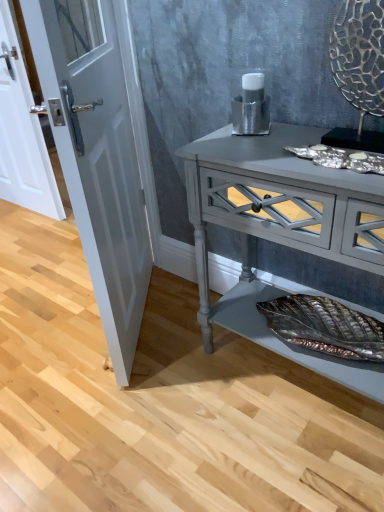
Question: Considering the relative sizes of matte gray console table at center and white glossy door at left, which is the second door in right-to-left order, in the image provided, is matte gray console table at center wider than white glossy door at left, which is the second door in right-to-left order,?

Choices:
 (A) yes
 (B) no

Answer: (A)

Question: Is matte gray console table at center completely or partially outside of white glossy door at left, the 1th door in the back-to-front sequence?

Choices:
 (A) no
 (B) yes

Answer: (B)

Question: Is matte gray console table at center to the right of white glossy door at left, which is the second door in right-to-left order, from the viewer's perspective?

Choices:
 (A) no
 (B) yes

Answer: (B)

Question: Considering the relative positions of matte gray console table at center and white glossy door at left, the first door positioned from the left, in the image provided, is matte gray console table at center to the left of white glossy door at left, the first door positioned from the left, from the viewer's perspective?

Choices:
 (A) no
 (B) yes

Answer: (A)

Question: Is matte gray console table at center shorter than white glossy door at left, arranged as the second door when viewed from the front?

Choices:
 (A) no
 (B) yes

Answer: (B)

Question: From a real-world perspective, is matte gray console table at center physically located above or below white glossy door at left, arranged as the second door when viewed from the front?

Choices:
 (A) above
 (B) below

Answer: (B)

Question: Does point (218, 301) appear closer or farther from the camera than point (1, 165)?

Choices:
 (A) closer
 (B) farther

Answer: (A)

Question: Considering the positions of matte gray console table at center and white glossy door at left, the first door positioned from the left, in the image, is matte gray console table at center taller or shorter than white glossy door at left, the first door positioned from the left,?

Choices:
 (A) tall
 (B) short

Answer: (B)

Question: Is matte gray console table at center bigger or smaller than white glossy door at left, the 1th door in the back-to-front sequence?

Choices:
 (A) big
 (B) small

Answer: (A)

Question: In terms of height, does white glossy door at left, the first door positioned from the left, look taller or shorter compared to white glossy door at left, which ranks as the 2th door in back-to-front order?

Choices:
 (A) tall
 (B) short

Answer: (B)

Question: Considering their positions, is white glossy door at left, the first door positioned from the left, located in front of or behind white glossy door at left, which is counted as the 1th door, starting from the front?

Choices:
 (A) behind
 (B) front

Answer: (A)

Question: Considering the positions of point (41, 201) and point (127, 238), is point (41, 201) closer or farther from the camera than point (127, 238)?

Choices:
 (A) farther
 (B) closer

Answer: (A)

Question: Looking at their shapes, would you say white glossy door at left, arranged as the second door when viewed from the front, is wider or thinner than white glossy door at left, arranged as the first door when viewed from the right?

Choices:
 (A) wide
 (B) thin

Answer: (B)

Question: Looking at the image, does white glossy door at left, which ranks as the 2th door in back-to-front order, seem bigger or smaller compared to matte gray console table at center?

Choices:
 (A) small
 (B) big

Answer: (A)

Question: From the image's perspective, is white glossy door at left, acting as the second door starting from the left, above or below matte gray console table at center?

Choices:
 (A) above
 (B) below

Answer: (A)